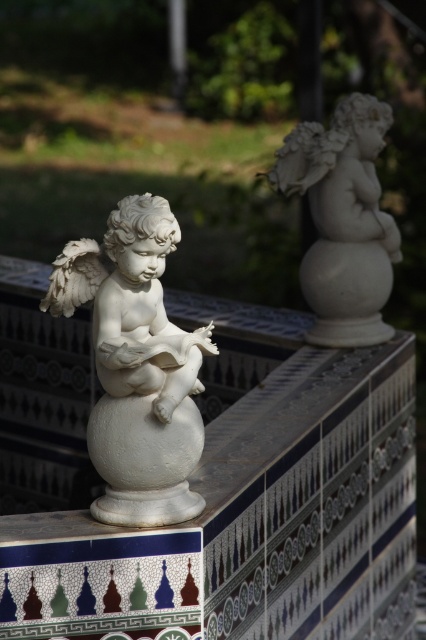
Question: Is white marble cherub at center positioned at the back of white marble cherub at upper right?

Choices:
 (A) yes
 (B) no

Answer: (B)

Question: Does white marble cherub at center appear on the right side of white marble cherub at upper right?

Choices:
 (A) no
 (B) yes

Answer: (A)

Question: Does white marble cherub at center appear on the left side of white marble cherub at upper right?

Choices:
 (A) yes
 (B) no

Answer: (A)

Question: Which point is farther from the camera taking this photo?

Choices:
 (A) (132, 440)
 (B) (374, 112)

Answer: (B)

Question: Which point is farther from the camera taking this photo?

Choices:
 (A) (299, 193)
 (B) (81, 260)

Answer: (A)